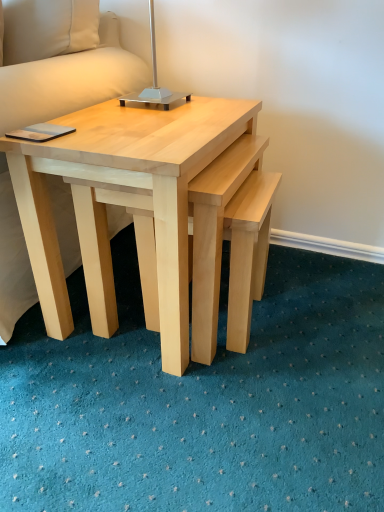
Locate an element on the screen. free space above natural wood coffee table at center (from a real-world perspective) is located at coordinates (152, 113).